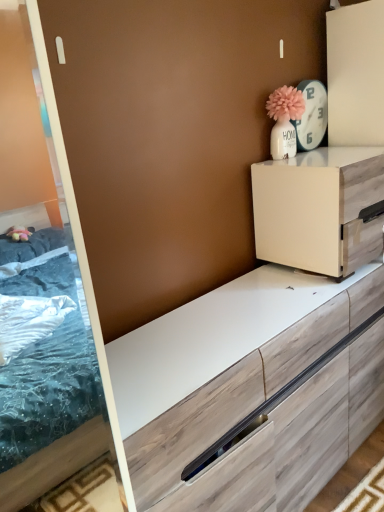
Describe the element at coordinates (312, 115) in the screenshot. The height and width of the screenshot is (512, 384). I see `white glossy clock at upper right` at that location.

Identify the location of white glossy clock at upper right. The height and width of the screenshot is (512, 384). (312, 115).

The width and height of the screenshot is (384, 512). Describe the element at coordinates (320, 209) in the screenshot. I see `white matte cabinet at upper right` at that location.

You are a GUI agent. You are given a task and a screenshot of the screen. Output one action in this format:
    pyautogui.click(x=<x>, y=<y>)
    Task: Click on the white matte cabinet at upper right
    
    Given the screenshot: What is the action you would take?
    pyautogui.click(x=320, y=209)

The width and height of the screenshot is (384, 512). I want to click on white glossy clock at upper right, so click(312, 115).

Is white glossy clock at upper right at the right side of white matte cabinet at upper right?

No.

Considering the positions of objects white glossy clock at upper right and white matte cabinet at upper right in the image provided, who is in front, white glossy clock at upper right or white matte cabinet at upper right?

white matte cabinet at upper right is closer to the camera.

Which is nearer, [316,110] or [255,234]?

Point [316,110] is positioned farther from the camera compared to point [255,234].

From the image's perspective, is white glossy clock at upper right over white matte cabinet at upper right?

Yes.

From a real-world perspective, which object stands above the other?

From a 3D spatial view, white glossy clock at upper right is above.

From the picture: Between white glossy clock at upper right and white matte cabinet at upper right, which one has larger width?

white matte cabinet at upper right is wider.

Is white glossy clock at upper right taller than white matte cabinet at upper right?

No.

Which of these two, white glossy clock at upper right or white matte cabinet at upper right, is bigger?

Bigger between the two is white matte cabinet at upper right.

Can we say white glossy clock at upper right lies outside white matte cabinet at upper right?

Yes, white glossy clock at upper right is located beyond the bounds of white matte cabinet at upper right.

In the scene shown: Is the surface of white glossy clock at upper right in direct contact with white matte cabinet at upper right?

white glossy clock at upper right and white matte cabinet at upper right are not in contact.

Is white glossy clock at upper right aimed at white matte cabinet at upper right?

No, white glossy clock at upper right does not turn towards white matte cabinet at upper right.

This screenshot has width=384, height=512. I want to click on the chest of drawers located below the white glossy clock at upper right (from the image's perspective), so click(320, 209).

Does white matte cabinet at upper right appear on the left side of white glossy clock at upper right?

No, white matte cabinet at upper right is not to the left of white glossy clock at upper right.

From the picture: Who is more distant, white matte cabinet at upper right or white glossy clock at upper right?

white glossy clock at upper right is behind.

Considering the points (299, 189) and (313, 124), which point is in front, point (299, 189) or point (313, 124)?

The point (299, 189) is more forward.

From the image's perspective, between white matte cabinet at upper right and white glossy clock at upper right, who is located below?

From the image's view, white matte cabinet at upper right is below.

From a real-world perspective, is white matte cabinet at upper right positioned above or below white glossy clock at upper right?

white matte cabinet at upper right is situated lower than white glossy clock at upper right in the real world.

Does white matte cabinet at upper right have a lesser width compared to white glossy clock at upper right?

In fact, white matte cabinet at upper right might be wider than white glossy clock at upper right.

Is white matte cabinet at upper right taller or shorter than white glossy clock at upper right?

Considering their sizes, white matte cabinet at upper right has more height than white glossy clock at upper right.

Considering the relative sizes of white matte cabinet at upper right and white glossy clock at upper right in the image provided, is white matte cabinet at upper right bigger than white glossy clock at upper right?

Yes, white matte cabinet at upper right is bigger than white glossy clock at upper right.

Would you say white glossy clock at upper right is part of white matte cabinet at upper right's contents?

No, white glossy clock at upper right is not inside white matte cabinet at upper right.

Is white matte cabinet at upper right next to white glossy clock at upper right and touching it?

No, white matte cabinet at upper right is not next to white glossy clock at upper right.

Is white matte cabinet at upper right looking in the opposite direction of white glossy clock at upper right?

No, white matte cabinet at upper right's orientation is not away from white glossy clock at upper right.

How different are the orientations of white matte cabinet at upper right and white glossy clock at upper right in degrees?

They differ by 1.85 degrees in their facing directions.

Measure the distance from white matte cabinet at upper right to white glossy clock at upper right.

They are 14.08 inches apart.

Where is `the chest of drawers in front of the white glossy clock at upper right`? This screenshot has width=384, height=512. the chest of drawers in front of the white glossy clock at upper right is located at coordinates (320, 209).

At what (x,y) coordinates should I click in order to perform the action: click on chest of drawers below the white glossy clock at upper right (from a real-world perspective). Please return your answer as a coordinate pair (x, y). The image size is (384, 512). Looking at the image, I should click on (320, 209).

Identify the location of chest of drawers in front of the white glossy clock at upper right. This screenshot has height=512, width=384. (320, 209).